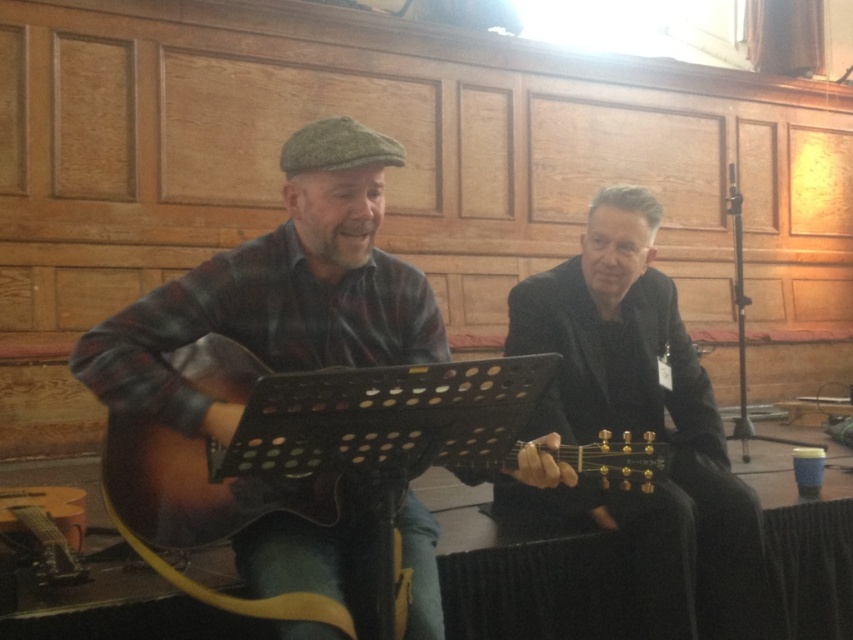
Question: Does matte brown guitar at left have a lesser width compared to matte brown acoustic guitar at left?

Choices:
 (A) no
 (B) yes

Answer: (B)

Question: Which of the following is the farthest from the observer?

Choices:
 (A) (590, 266)
 (B) (120, 497)

Answer: (A)

Question: Based on their relative distances, which object is nearer to the matte brown acoustic guitar at left?

Choices:
 (A) shiny black guitar at center
 (B) matte brown guitar at left

Answer: (B)

Question: Can you confirm if matte brown guitar at left is positioned to the right of matte brown acoustic guitar at left?

Choices:
 (A) no
 (B) yes

Answer: (A)

Question: Is shiny black guitar at center thinner than matte brown acoustic guitar at left?

Choices:
 (A) no
 (B) yes

Answer: (B)

Question: Estimate the real-world distances between objects in this image. Which object is farther from the matte brown guitar at left?

Choices:
 (A) shiny black guitar at center
 (B) matte brown acoustic guitar at left

Answer: (A)